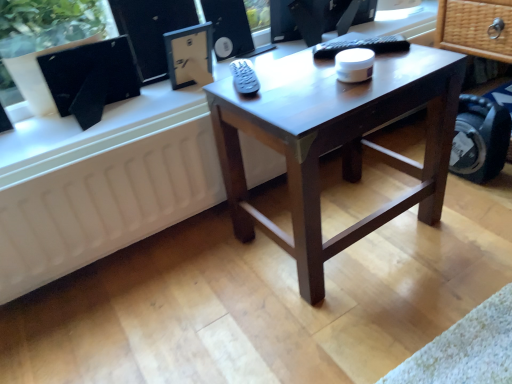
Identify the location of blank space situated above white matte radiator at lower left (from a real-world perspective). The image size is (512, 384). (96, 148).